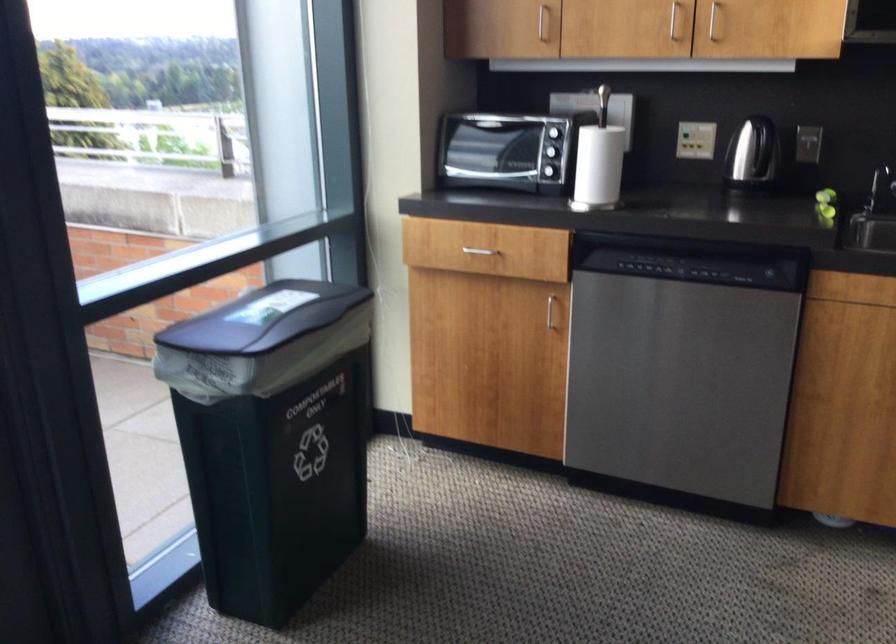
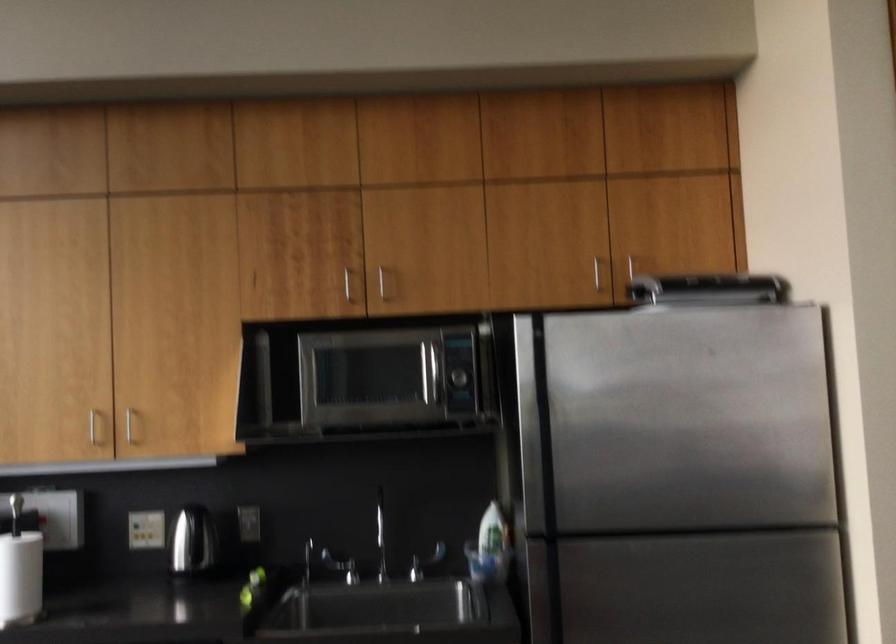
First-person continuous shooting, in which direction is the camera rotating?

The rotation direction of the camera is right-up.